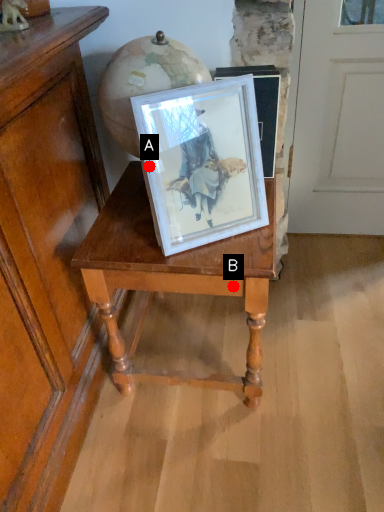
Question: Two points are circled on the image, labeled by A and B beside each circle. Which point is further to the camera?

Choices:
 (A) A is further
 (B) B is further

Answer: (B)